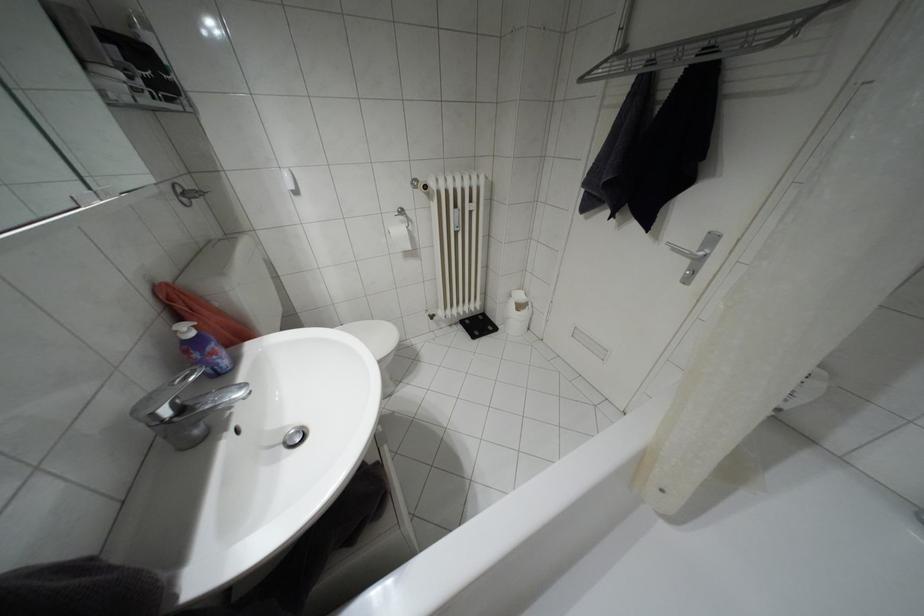
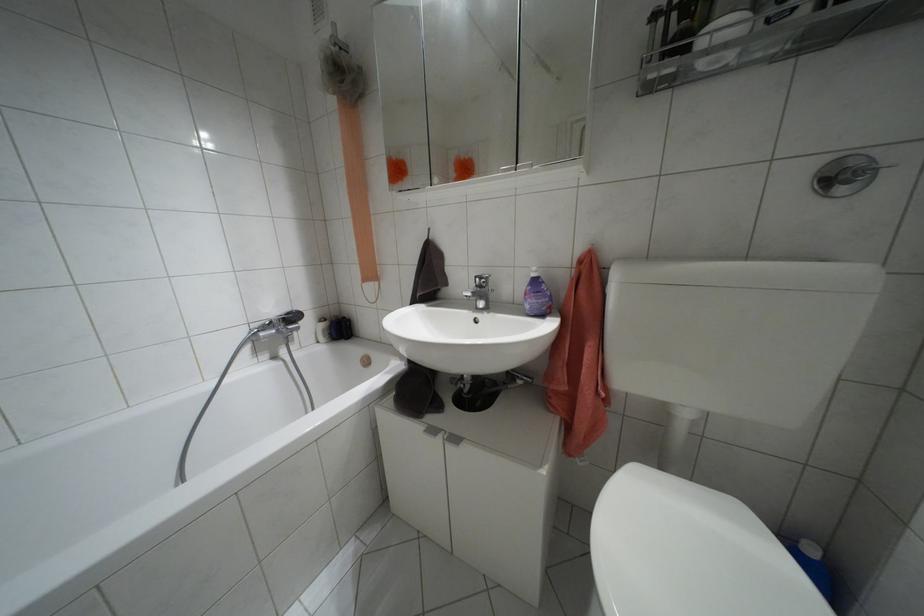
Locate, in the second image, the point that corresponds to point (180, 408) in the first image.

(479, 286)